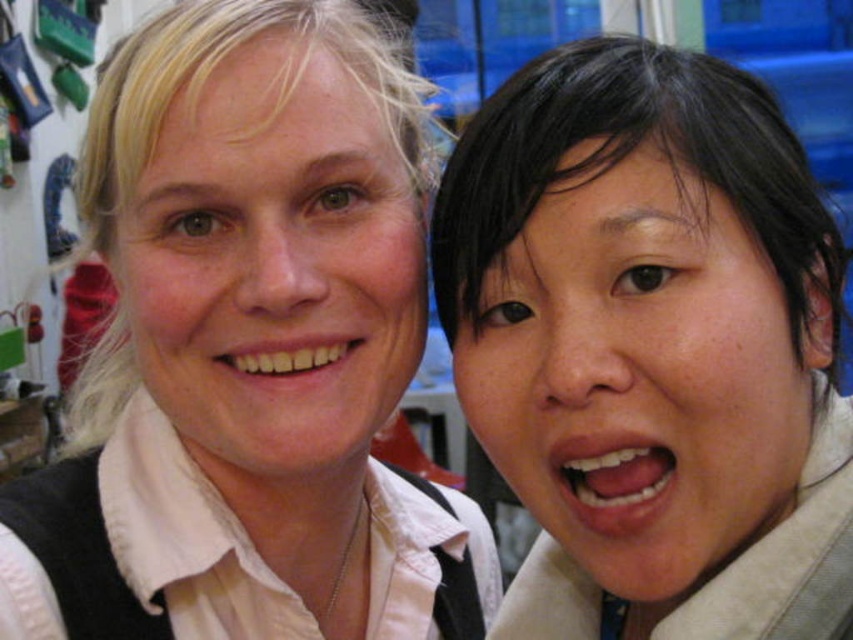
Does matte white shirt at center have a lesser width compared to matte white face at upper left?

No.

Is matte white shirt at center below matte white face at upper left?

Indeed, matte white shirt at center is positioned under matte white face at upper left.

Is point (268, 129) positioned before point (361, 365)?

Yes, it is.

This screenshot has height=640, width=853. I want to click on matte white shirt at center, so click(x=242, y=348).

Does point (193, 621) come farther from viewer compared to point (767, 429)?

Yes, point (193, 621) is behind point (767, 429).

Between point (195, 38) and point (451, 333), which one is positioned behind?

Positioned behind is point (451, 333).

Where is `matte white shirt at center`? matte white shirt at center is located at coordinates (242, 348).

Which is more to the right, white glossy teeth at lower right or white glossy teeth at center?

white glossy teeth at lower right is more to the right.

Measure the distance from white glossy teeth at lower right to white glossy teeth at center.

white glossy teeth at lower right is 6.20 inches away from white glossy teeth at center.

This screenshot has width=853, height=640. Describe the element at coordinates (611, 480) in the screenshot. I see `white glossy teeth at lower right` at that location.

Locate an element on the screen. The width and height of the screenshot is (853, 640). white glossy teeth at lower right is located at coordinates (611, 480).